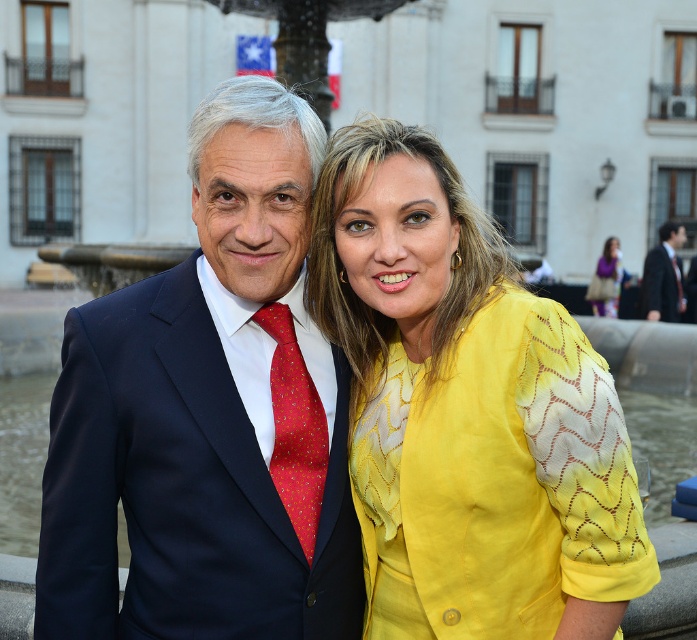
Is red silk tie at center thinner than dark blue suit at right?

Indeed, red silk tie at center has a lesser width compared to dark blue suit at right.

Which is in front, point (293, 403) or point (664, 259)?

Point (293, 403) is more forward.

Is point (307, 394) farther from camera compared to point (657, 268)?

That is False.

Find the location of a particular element. The height and width of the screenshot is (640, 697). red silk tie at center is located at coordinates (293, 428).

Consider the image. Who is higher up, navy blue suit at center or yellow textured blouse at center?

navy blue suit at center

Does navy blue suit at center appear on the right side of yellow textured blouse at center?

In fact, navy blue suit at center is to the left of yellow textured blouse at center.

Is point (275, 252) positioned behind point (475, 602)?

Yes, it is behind point (475, 602).

This screenshot has width=697, height=640. What are the coordinates of `navy blue suit at center` in the screenshot? It's located at (208, 416).

Does yellow textured blouse at center lie in front of red silk tie at center?

Yes, it is.

Can you confirm if yellow textured blouse at center is positioned to the right of red silk tie at center?

Correct, you'll find yellow textured blouse at center to the right of red silk tie at center.

What do you see at coordinates (466, 410) in the screenshot? The width and height of the screenshot is (697, 640). I see `yellow textured blouse at center` at bounding box center [466, 410].

Find the location of a particular element. The height and width of the screenshot is (640, 697). yellow textured blouse at center is located at coordinates (466, 410).